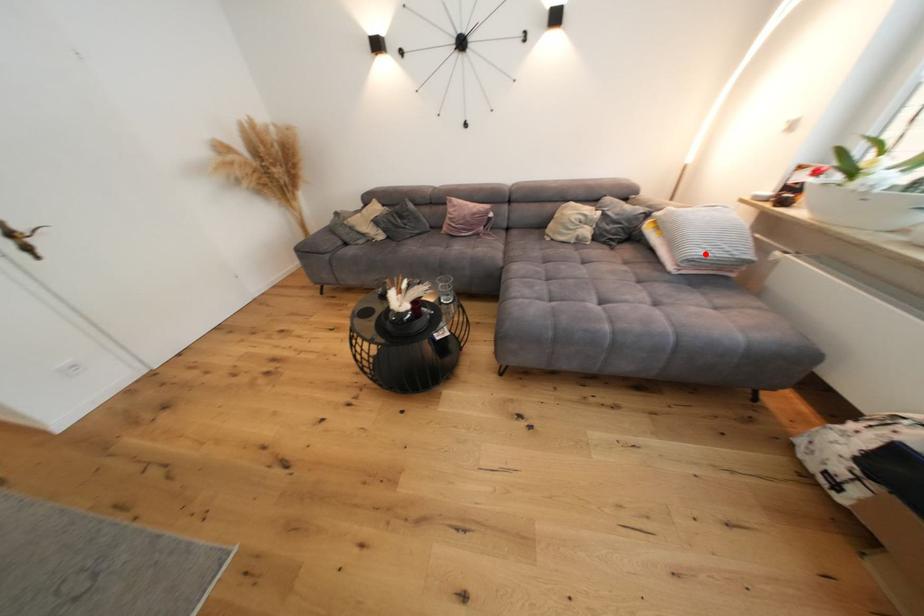
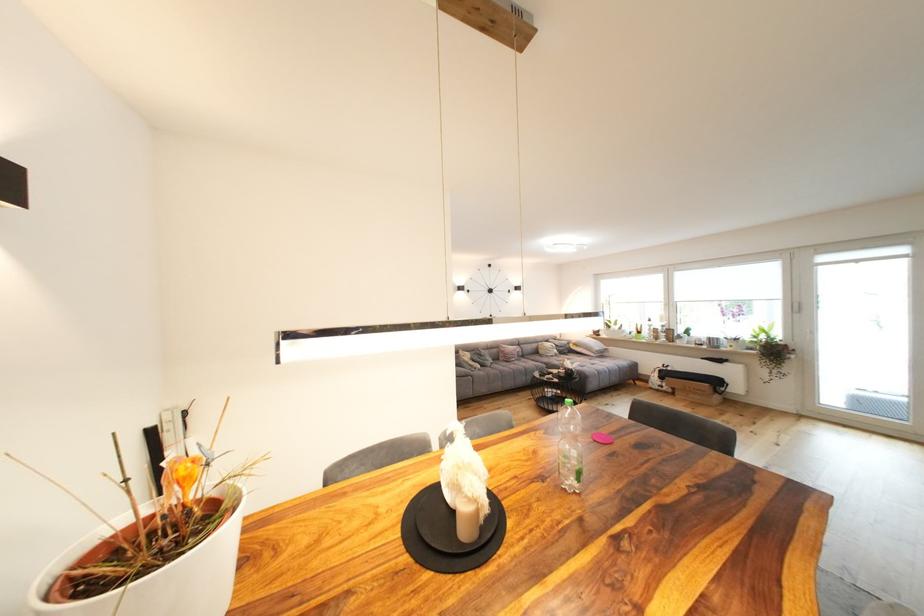
Where in the second image is the point corresponding to the highlighted location from the first image?

(603, 350)